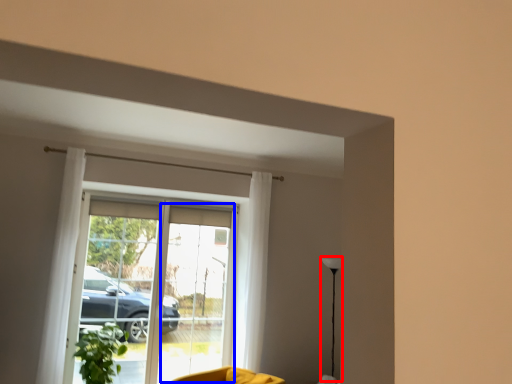
Question: Which object is further to the camera taking this photo, lamp (highlighted by a red box) or screen door (highlighted by a blue box)?

Choices:
 (A) lamp
 (B) screen door

Answer: (B)